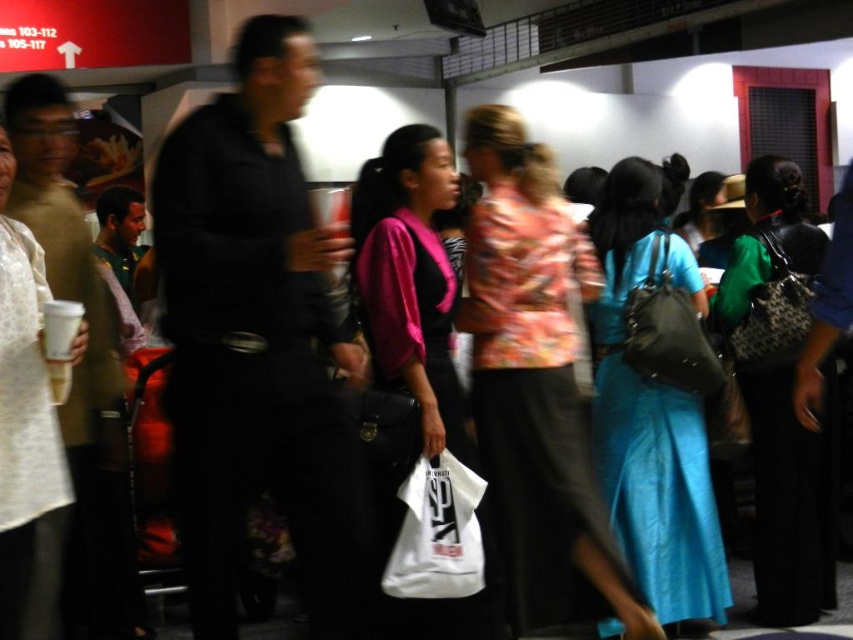
You are a fashion designer observing the crowd and notice two dresses at the center of the scene. The matte blue dress at center and the green textured dress at center. Can you determine if there is enough space between them to comfortably fit a third dress of average size?

The matte blue dress at center and green textured dress at center are 12.49 inches apart from each other. An average dress typically measures around 18 to 24 inches in width. Since the space between them is narrower than the width of an average dress, there isn

Where is the pink matte jacket at center located in the image?

The pink matte jacket at center is located at point 0.491 on the x axis and 0.476 on the y axis.

You are standing in the busy transportation hub and notice a point marked at coordinates (x=650, y=419). Which object is this point located on?

The point at (x=650, y=419) is located on the matte blue dress at center.